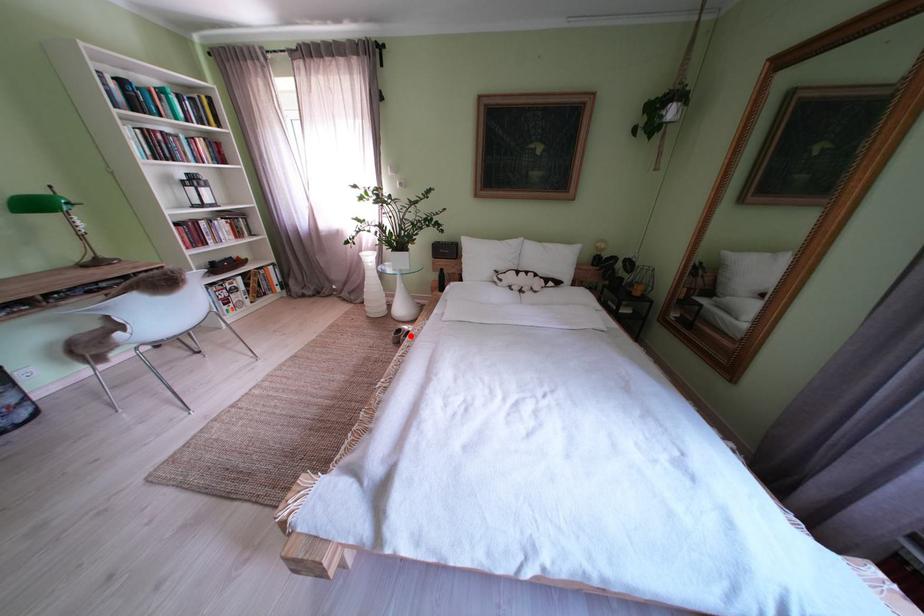
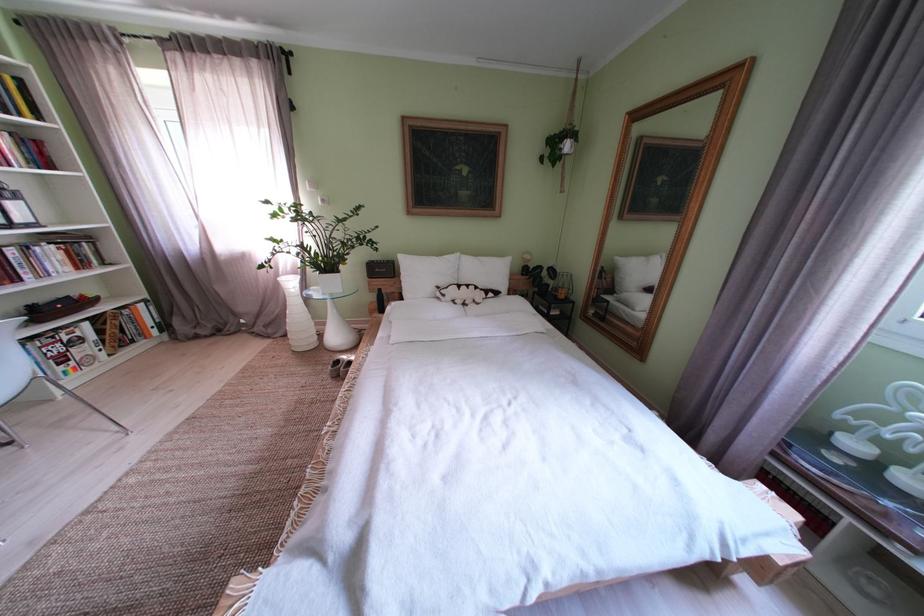
The point at the highlighted location is marked in the first image. Where is the corresponding point in the second image?

(348, 367)